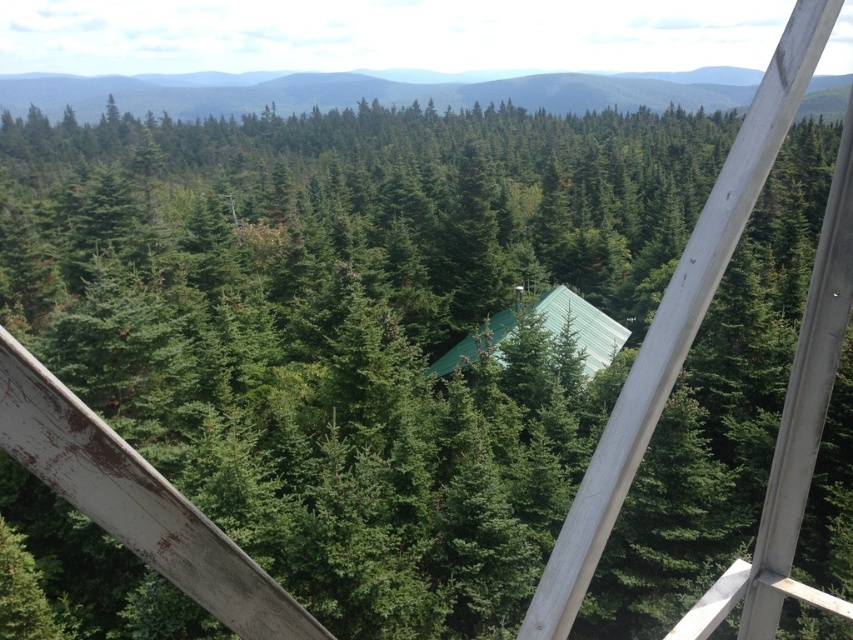
Question: Does green matte forest at upper center appear on the left side of green metal cabin at center?

Choices:
 (A) no
 (B) yes

Answer: (B)

Question: Is green matte forest at upper center below green metal cabin at center?

Choices:
 (A) no
 (B) yes

Answer: (A)

Question: Does green matte forest at upper center appear on the left side of green metal cabin at center?

Choices:
 (A) yes
 (B) no

Answer: (A)

Question: Which point appears closest to the camera in this image?

Choices:
 (A) coord(277,88)
 (B) coord(492,317)

Answer: (B)